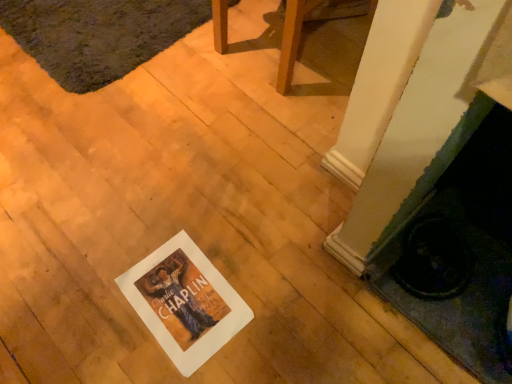
Question: Considering the relative sizes of dark gray shaggy rug at upper left and wooden chair at center in the image provided, is dark gray shaggy rug at upper left thinner than wooden chair at center?

Choices:
 (A) yes
 (B) no

Answer: (B)

Question: From the image's perspective, does dark gray shaggy rug at upper left appear lower than wooden chair at center?

Choices:
 (A) yes
 (B) no

Answer: (B)

Question: From a real-world perspective, is dark gray shaggy rug at upper left below wooden chair at center?

Choices:
 (A) yes
 (B) no

Answer: (A)

Question: Considering the relative sizes of dark gray shaggy rug at upper left and wooden chair at center in the image provided, is dark gray shaggy rug at upper left wider than wooden chair at center?

Choices:
 (A) yes
 (B) no

Answer: (A)

Question: Is dark gray shaggy rug at upper left in contact with wooden chair at center?

Choices:
 (A) no
 (B) yes

Answer: (A)

Question: Considering the positions of point (10, 1) and point (291, 33), is point (10, 1) closer or farther from the camera than point (291, 33)?

Choices:
 (A) closer
 (B) farther

Answer: (B)

Question: Is dark gray shaggy rug at upper left in front of or behind wooden chair at center in the image?

Choices:
 (A) front
 (B) behind

Answer: (B)

Question: From a real-world perspective, relative to wooden chair at center, is dark gray shaggy rug at upper left vertically above or below?

Choices:
 (A) below
 (B) above

Answer: (A)

Question: Choose the correct answer: Is dark gray shaggy rug at upper left inside wooden chair at center or outside it?

Choices:
 (A) outside
 (B) inside

Answer: (A)

Question: From the image's perspective, relative to dark gray shaggy rug at upper left, is wooden chair at center above or below?

Choices:
 (A) below
 (B) above

Answer: (A)

Question: Is point (224, 19) positioned closer to the camera than point (230, 3)?

Choices:
 (A) closer
 (B) farther

Answer: (A)

Question: In the image, is wooden chair at center on the left side or the right side of dark gray shaggy rug at upper left?

Choices:
 (A) right
 (B) left

Answer: (A)

Question: Considering the positions of wooden chair at center and dark gray shaggy rug at upper left in the image, is wooden chair at center bigger or smaller than dark gray shaggy rug at upper left?

Choices:
 (A) small
 (B) big

Answer: (B)

Question: Would you say white paper at center is to the left or to the right of wooden chair at center in the picture?

Choices:
 (A) right
 (B) left

Answer: (B)

Question: Is white paper at center taller or shorter than wooden chair at center?

Choices:
 (A) tall
 (B) short

Answer: (B)